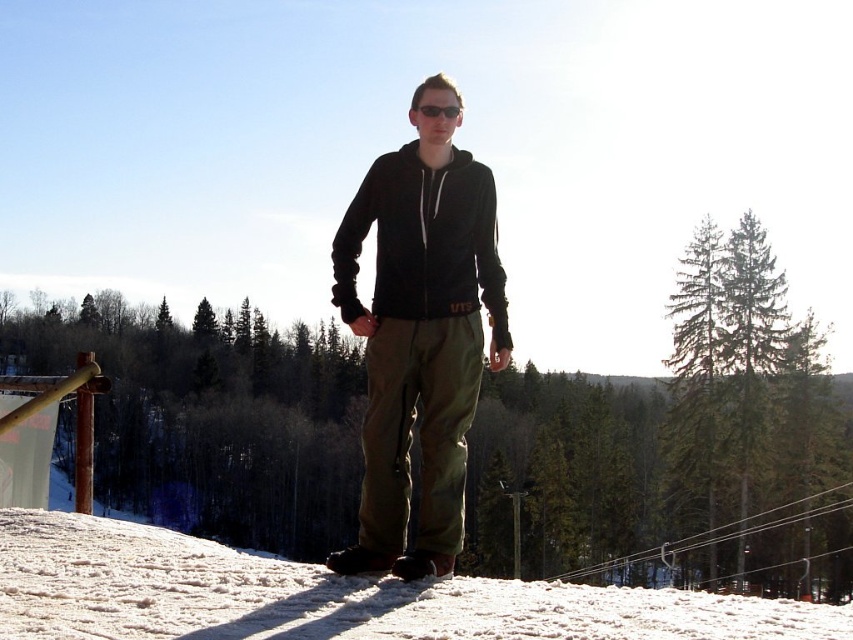
Question: From the image, what is the correct spatial relationship of white snow at lower center in relation to black fleece sweatshirt at center?

Choices:
 (A) right
 (B) left

Answer: (B)

Question: Which object is the farthest from the white snow at lower center?

Choices:
 (A) black fleece sweatshirt at center
 (B) matte black hoodie at center

Answer: (A)

Question: Is matte black hoodie at center further to the viewer compared to black fleece sweatshirt at center?

Choices:
 (A) no
 (B) yes

Answer: (A)

Question: Can you confirm if white snow at lower center is positioned below matte black hoodie at center?

Choices:
 (A) no
 (B) yes

Answer: (B)

Question: Which is nearer to the black fleece sweatshirt at center?

Choices:
 (A) matte black hoodie at center
 (B) white snow at lower center

Answer: (A)

Question: Which of the following is the closest to the observer?

Choices:
 (A) (413, 275)
 (B) (4, 579)
 (C) (426, 141)

Answer: (B)